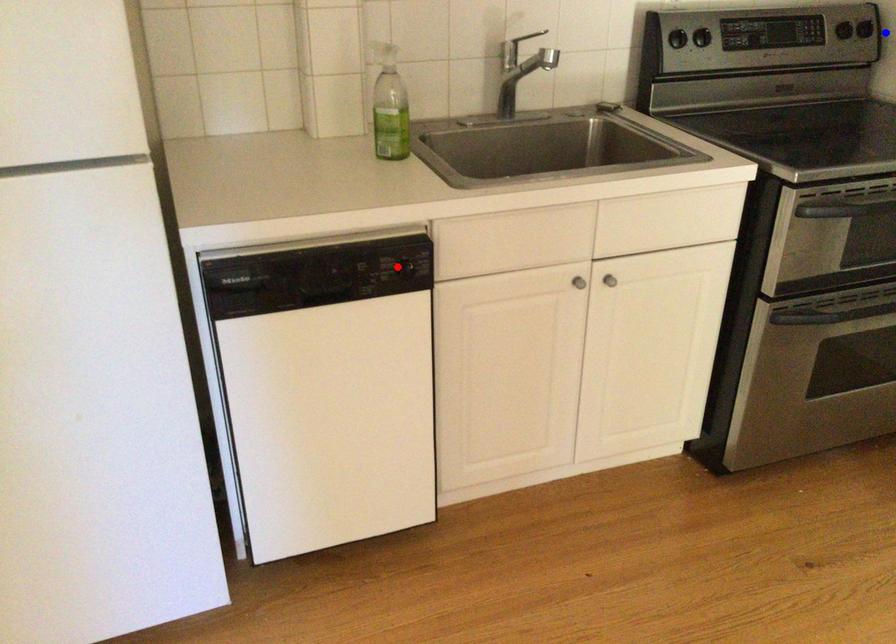
Question: Which of the two points in the image is closer to the camera?

Choices:
 (A) Blue point is closer.
 (B) Red point is closer.

Answer: (B)